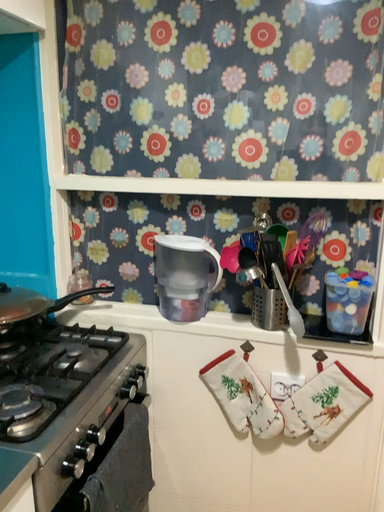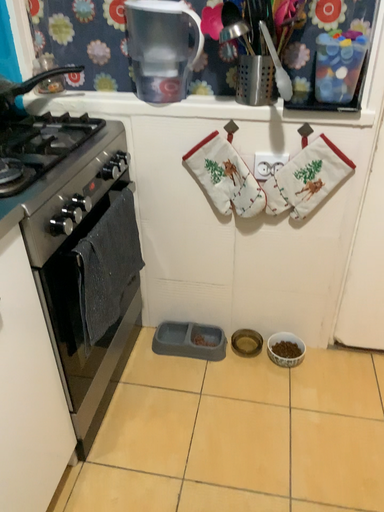
Question: Which way did the camera rotate in the video?

Choices:
 (A) rotated downward
 (B) rotated upward

Answer: (A)